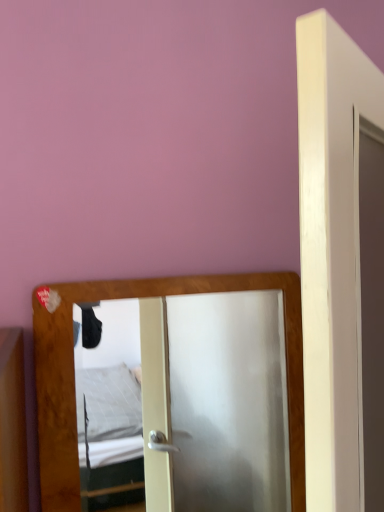
The height and width of the screenshot is (512, 384). What do you see at coordinates (341, 266) in the screenshot?
I see `white matte door at center` at bounding box center [341, 266].

Find the location of a particular element. The height and width of the screenshot is (512, 384). white matte door at center is located at coordinates (341, 266).

Locate an element on the screen. wooden mirror at center is located at coordinates (191, 400).

In order to face wooden mirror at center, should I rotate leftwards or rightwards?

To align with it, rotate right about 1.060°.

Image resolution: width=384 pixels, height=512 pixels. What do you see at coordinates (191, 400) in the screenshot?
I see `wooden mirror at center` at bounding box center [191, 400].

Locate an element on the screen. The image size is (384, 512). white matte door at center is located at coordinates (341, 266).

Is wooden mirror at center at the left side of white matte door at center?

Correct, you'll find wooden mirror at center to the left of white matte door at center.

Is the position of wooden mirror at center more distant than that of white matte door at center?

Yes, wooden mirror at center is further from the camera.

Which is less distant, (222, 360) or (324, 47)?

The point (324, 47) is closer.

From the image's perspective, which one is positioned higher, wooden mirror at center or white matte door at center?

white matte door at center appears higher in the image.

From a real-world perspective, is wooden mirror at center positioned under white matte door at center based on gravity?

Correct, in the physical world, wooden mirror at center is lower than white matte door at center.

In terms of width, does wooden mirror at center look wider or thinner when compared to white matte door at center?

In the image, wooden mirror at center appears to be wider than white matte door at center.

In terms of height, does wooden mirror at center look taller or shorter compared to white matte door at center?

wooden mirror at center is shorter than white matte door at center.

From the picture: Which of these two, wooden mirror at center or white matte door at center, is bigger?

Bigger between the two is white matte door at center.

Is wooden mirror at center completely or partially outside of white matte door at center?

Yes, wooden mirror at center is not within white matte door at center.

Is wooden mirror at center positioned far away from white matte door at center?

Yes.

Is wooden mirror at center turned away from white matte door at center?

No.

How many degrees apart are the facing directions of wooden mirror at center and white matte door at center?

wooden mirror at center and white matte door at center are facing 38.2 degrees away from each other.

Measure the distance between wooden mirror at center and white matte door at center.

wooden mirror at center and white matte door at center are 8.56 feet apart.

You are a GUI agent. You are given a task and a screenshot of the screen. Output one action in this format:
    pyautogui.click(x=<x>, y=<y>)
    Task: Click on the door above the wooden mirror at center (from the image's perspective)
    The height and width of the screenshot is (512, 384).
    Given the screenshot: What is the action you would take?
    pyautogui.click(x=341, y=266)

Is white matte door at center at the left side of wooden mirror at center?

Incorrect, white matte door at center is not on the left side of wooden mirror at center.

Relative to wooden mirror at center, is white matte door at center in front or behind?

white matte door at center is in front of wooden mirror at center.

Does point (314, 115) lie in front of point (239, 502)?

Yes, point (314, 115) is in front of point (239, 502).

From the image's perspective, is white matte door at center above or below wooden mirror at center?

Based on their image positions, white matte door at center is located above wooden mirror at center.

From a real-world perspective, is white matte door at center located beneath wooden mirror at center?

Actually, white matte door at center is physically above wooden mirror at center in the real world.

Is white matte door at center wider than wooden mirror at center?

No.

Which of these two, white matte door at center or wooden mirror at center, stands shorter?

wooden mirror at center is shorter.

In terms of size, does white matte door at center appear bigger or smaller than wooden mirror at center?

In the image, white matte door at center appears to be larger than wooden mirror at center.

Is white matte door at center inside or outside of wooden mirror at center?

white matte door at center exists outside the volume of wooden mirror at center.

Is white matte door at center directly adjacent to wooden mirror at center?

No, white matte door at center is not in contact with wooden mirror at center.

Is white matte door at center oriented away from wooden mirror at center?

Correct, white matte door at center is looking away from wooden mirror at center.

Find the location of `mirror below the white matte door at center (from the image's perspective)`. mirror below the white matte door at center (from the image's perspective) is located at coordinates (191, 400).

I want to click on door in front of the wooden mirror at center, so click(341, 266).

Identify the location of mirror behind the white matte door at center. (191, 400).